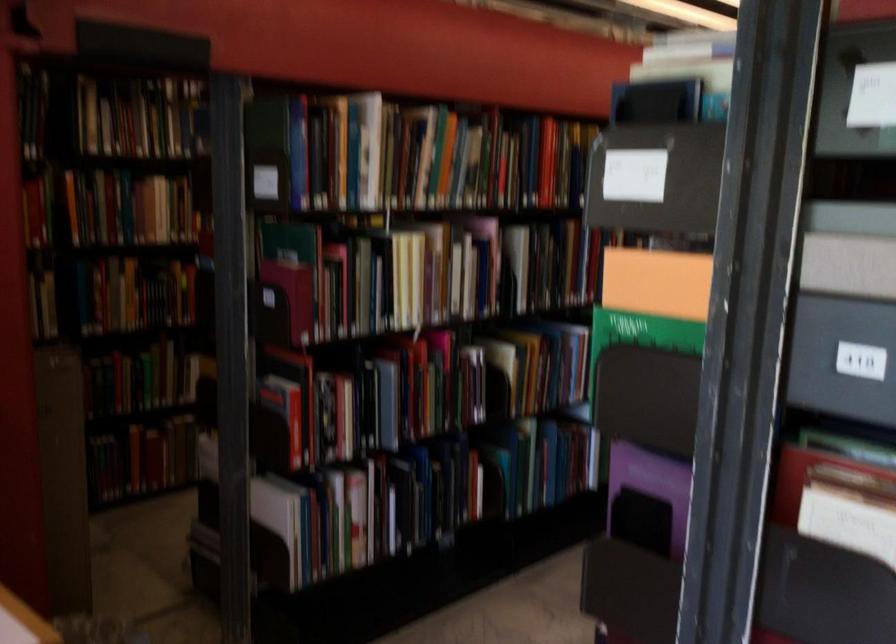
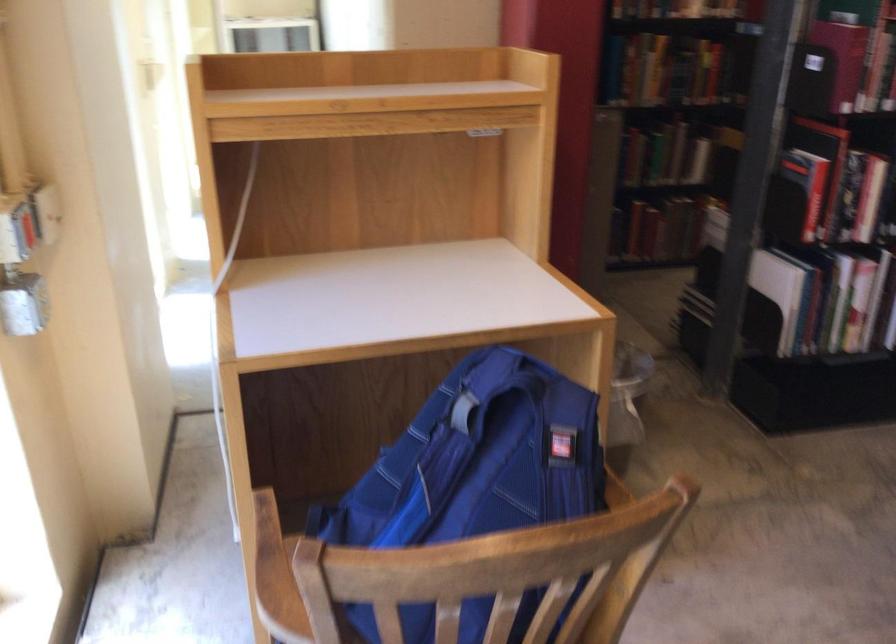
Find the pixel in the second image that matches point 291,310 in the first image.

(842, 59)